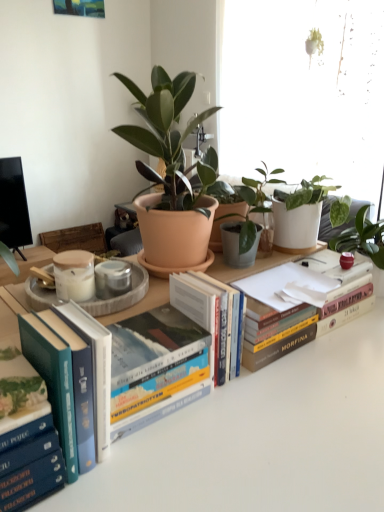
What is the approximate height of matte terracotta pot at center?

It is 17.71 inches.

Locate an element on the screen. This screenshot has width=384, height=512. hardcover book at center, positioned as the third book in left-to-right order is located at coordinates (156, 367).

Find the location of a particular element. The image size is (384, 512). matte terracotta pot at center is located at coordinates (171, 170).

In terms of width, does hardcover books at left, which appears as the fourth book when viewed from the right, look wider or thinner when compared to matte terracotta pot at center?

Clearly, hardcover books at left, which appears as the fourth book when viewed from the right, has less width compared to matte terracotta pot at center.

Considering the relative sizes of hardcover books at left, arranged as the 2th book when viewed from the left, and matte terracotta pot at center in the image provided, is hardcover books at left, arranged as the 2th book when viewed from the left, shorter than matte terracotta pot at center?

Yes, hardcover books at left, arranged as the 2th book when viewed from the left, is shorter than matte terracotta pot at center.

Which object is further away from the camera, hardcover books at left, arranged as the 2th book when viewed from the left, or matte terracotta pot at center?

matte terracotta pot at center.

In the scene shown: From the image's perspective, who appears lower, hardcover books at left, arranged as the 2th book when viewed from the left, or matte terracotta pot at center?

hardcover books at left, arranged as the 2th book when viewed from the left, appears lower in the image.

Is hardcover book at center, positioned as the third book in left-to-right order, at the back of blue hardcover book at lower left, which is the 5th book in right-to-left order?

No, hardcover book at center, positioned as the third book in left-to-right order, is not at the back of blue hardcover book at lower left, which is the 5th book in right-to-left order.

From the image's perspective, which is below, blue hardcover book at lower left, which is the 1th book in left-to-right order, or hardcover book at center, the third book from the right?

blue hardcover book at lower left, which is the 1th book in left-to-right order, from the image's perspective.

Locate an element on the screen. The image size is (384, 512). the 1st book positioned below the blue hardcover book at lower left, which is the 5th book in right-to-left order (from a real-world perspective) is located at coordinates (156, 367).

Which object is closer to the camera taking this photo, hardcover book at center, placed as the 4th book when sorted from left to right, or matte terracotta pot at center?

Positioned in front is matte terracotta pot at center.

Would you say hardcover book at center, which is the 2th book from right to left, contains matte terracotta pot at center?

No, matte terracotta pot at center is not inside hardcover book at center, which is the 2th book from right to left.

From a real-world perspective, who is located lower, hardcover book at center, placed as the 4th book when sorted from left to right, or matte terracotta pot at center?

From a 3D spatial view, hardcover book at center, placed as the 4th book when sorted from left to right, is below.

Considering the sizes of hardcover book at center, which is the 2th book from right to left, and matte terracotta pot at center in the image, is hardcover book at center, which is the 2th book from right to left, taller or shorter than matte terracotta pot at center?

Clearly, hardcover book at center, which is the 2th book from right to left, is shorter compared to matte terracotta pot at center.

From the image's perspective, which one is positioned lower, hardcover books at left, which appears as the fourth book when viewed from the right, or hardcover book at center, placed as the first book when sorted from right to left?

hardcover books at left, which appears as the fourth book when viewed from the right, is shown below in the image.

Is hardcover books at left, arranged as the 2th book when viewed from the left, outside of hardcover book at center, placed as the first book when sorted from right to left?

Indeed, hardcover books at left, arranged as the 2th book when viewed from the left, is completely outside hardcover book at center, placed as the first book when sorted from right to left.

Is hardcover books at left, arranged as the 2th book when viewed from the left, wider than hardcover book at center, placed as the first book when sorted from right to left?

Correct, the width of hardcover books at left, arranged as the 2th book when viewed from the left, exceeds that of hardcover book at center, placed as the first book when sorted from right to left.

Considering the relative sizes of hardcover book at center, placed as the 5th book when sorted from left to right, and matte terracotta pot at center in the image provided, is hardcover book at center, placed as the 5th book when sorted from left to right, thinner than matte terracotta pot at center?

Yes.

From the image's perspective, which book is the 1st one below the matte terracotta pot at center? Please provide its 2D coordinates.

[(294, 308)]

From a real-world perspective, is hardcover book at center, placed as the first book when sorted from right to left, physically below matte terracotta pot at center?

Indeed, from a real-world perspective, hardcover book at center, placed as the first book when sorted from right to left, is positioned beneath matte terracotta pot at center.

Which book is the 1st one when counting from the right side of the hardcover books at left, which appears as the fourth book when viewed from the right? Please provide its 2D coordinates.

[(156, 367)]

Does hardcover book at center, positioned as the third book in left-to-right order, turn towards hardcover books at left, arranged as the 2th book when viewed from the left?

No, hardcover book at center, positioned as the third book in left-to-right order, is not facing towards hardcover books at left, arranged as the 2th book when viewed from the left.

Does hardcover book at center, the third book from the right, have a lesser height compared to hardcover books at left, which appears as the fourth book when viewed from the right?

Indeed, hardcover book at center, the third book from the right, has a lesser height compared to hardcover books at left, which appears as the fourth book when viewed from the right.

From the picture: How much distance is there between hardcover book at center, positioned as the third book in left-to-right order, and hardcover books at left, which appears as the fourth book when viewed from the right?

9.89 centimeters.

Between matte terracotta pot at center and hardcover book at center, the third book from the right, which one has less height?

Standing shorter between the two is hardcover book at center, the third book from the right.

From a real-world perspective, is matte terracotta pot at center positioned over hardcover book at center, positioned as the third book in left-to-right order, based on gravity?

Yes, from a real-world perspective, matte terracotta pot at center is above hardcover book at center, positioned as the third book in left-to-right order.

Which object is closer to the camera, matte terracotta pot at center or hardcover book at center, positioned as the third book in left-to-right order?

hardcover book at center, positioned as the third book in left-to-right order, is closer to the camera.

Can you tell me how much matte terracotta pot at center and hardcover book at center, the third book from the right, differ in facing direction?

The angle between the facing direction of matte terracotta pot at center and the facing direction of hardcover book at center, the third book from the right, is 179 degrees.

The width and height of the screenshot is (384, 512). In order to click on the 2nd book counting from the left side of the matte terracotta pot at center in this screenshot , I will do `click(64, 384)`.

Locate an element on the screen. Image resolution: width=384 pixels, height=512 pixels. book below the hardcover book at center, positioned as the third book in left-to-right order (from the image's perspective) is located at coordinates (31, 465).

Based on their spatial positions, is hardcover book at center, positioned as the third book in left-to-right order, or hardcover books at left, arranged as the 2th book when viewed from the left, closer to matte terracotta pot at center?

Among the two, hardcover book at center, positioned as the third book in left-to-right order, is located nearer to matte terracotta pot at center.

Based on their spatial positions, is blue hardcover book at lower left, which is the 5th book in right-to-left order, or hardcover book at center, the third book from the right, closer to hardcover book at center, which is the 2th book from right to left?

Based on the image, hardcover book at center, the third book from the right, appears to be nearer to hardcover book at center, which is the 2th book from right to left.

From the image, which object appears to be farther from hardcover book at center, placed as the 5th book when sorted from left to right, hardcover book at center, which is the 2th book from right to left, or blue hardcover book at lower left, which is the 1th book in left-to-right order?

blue hardcover book at lower left, which is the 1th book in left-to-right order, lies further to hardcover book at center, placed as the 5th book when sorted from left to right, than the other object.

When comparing their distances from hardcover books at left, which appears as the fourth book when viewed from the right, does matte terracotta pot at center or blue hardcover book at lower left, which is the 5th book in right-to-left order, seem further?

matte terracotta pot at center lies further to hardcover books at left, which appears as the fourth book when viewed from the right, than the other object.

When comparing their distances from blue hardcover book at lower left, which is the 5th book in right-to-left order, does hardcover books at left, arranged as the 2th book when viewed from the left, or hardcover book at center, placed as the 5th book when sorted from left to right, seem further?

hardcover book at center, placed as the 5th book when sorted from left to right, lies further to blue hardcover book at lower left, which is the 5th book in right-to-left order, than the other object.

In the scene shown: Based on their spatial positions, is hardcover book at center, placed as the 5th book when sorted from left to right, or hardcover book at center, placed as the 4th book when sorted from left to right, further from matte terracotta pot at center?

Based on the image, hardcover book at center, placed as the 5th book when sorted from left to right, appears to be further to matte terracotta pot at center.

When comparing their distances from blue hardcover book at lower left, which is the 1th book in left-to-right order, does hardcover book at center, positioned as the third book in left-to-right order, or hardcover book at center, placed as the first book when sorted from right to left, seem closer?

Based on the image, hardcover book at center, positioned as the third book in left-to-right order, appears to be nearer to blue hardcover book at lower left, which is the 1th book in left-to-right order.

Looking at the image, which one is located closer to hardcover book at center, placed as the 5th book when sorted from left to right, matte terracotta pot at center or hardcover book at center, positioned as the third book in left-to-right order?

hardcover book at center, positioned as the third book in left-to-right order, lies closer to hardcover book at center, placed as the 5th book when sorted from left to right, than the other object.

Locate an element on the screen. The height and width of the screenshot is (512, 384). book between blue hardcover book at lower left, which is the 5th book in right-to-left order, and hardcover book at center, positioned as the third book in left-to-right order, in the horizontal direction is located at coordinates pos(64,384).

Identify the location of houseplant located between hardcover books at left, which appears as the fourth book when viewed from the right, and hardcover book at center, placed as the 5th book when sorted from left to right, in the left-right direction. (171, 170).

Image resolution: width=384 pixels, height=512 pixels. Find the location of `book between hardcover books at left, arranged as the 2th book when viewed from the left, and hardcover book at center, placed as the 4th book when sorted from left to right`. book between hardcover books at left, arranged as the 2th book when viewed from the left, and hardcover book at center, placed as the 4th book when sorted from left to right is located at coordinates (156, 367).

The image size is (384, 512). In order to click on book situated between hardcover book at center, the third book from the right, and hardcover book at center, placed as the first book when sorted from right to left, from left to right in this screenshot , I will do `click(210, 313)`.